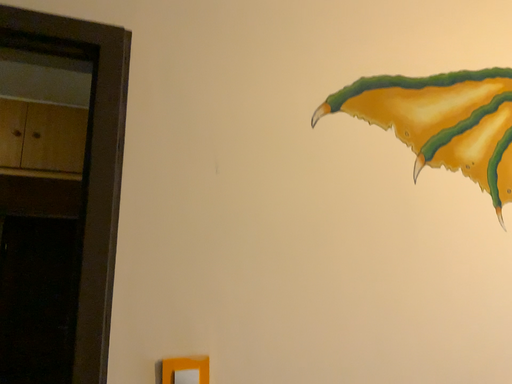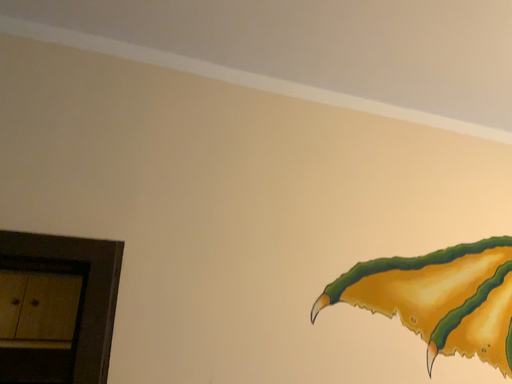
Question: How did the camera likely rotate when shooting the video?

Choices:
 (A) rotated downward
 (B) rotated upward

Answer: (B)